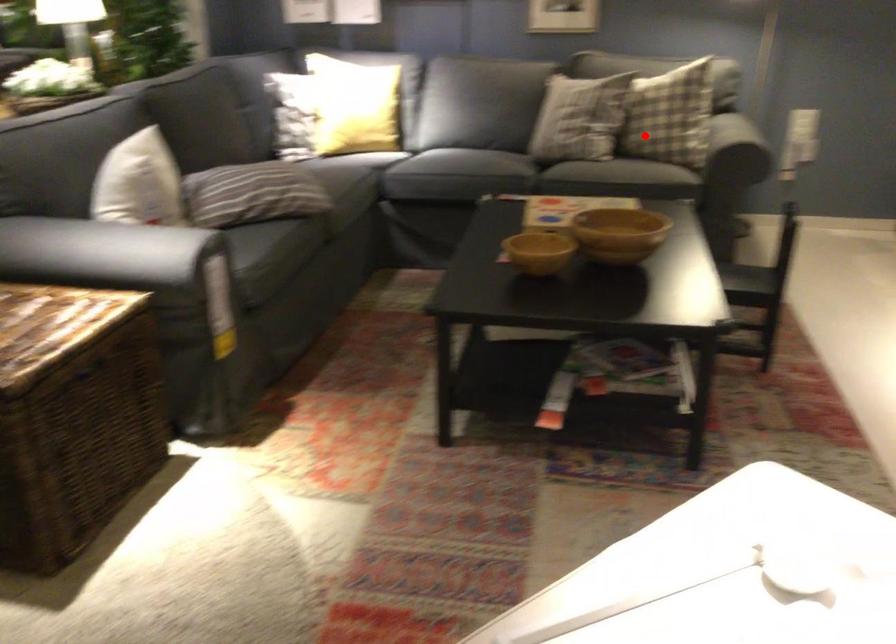
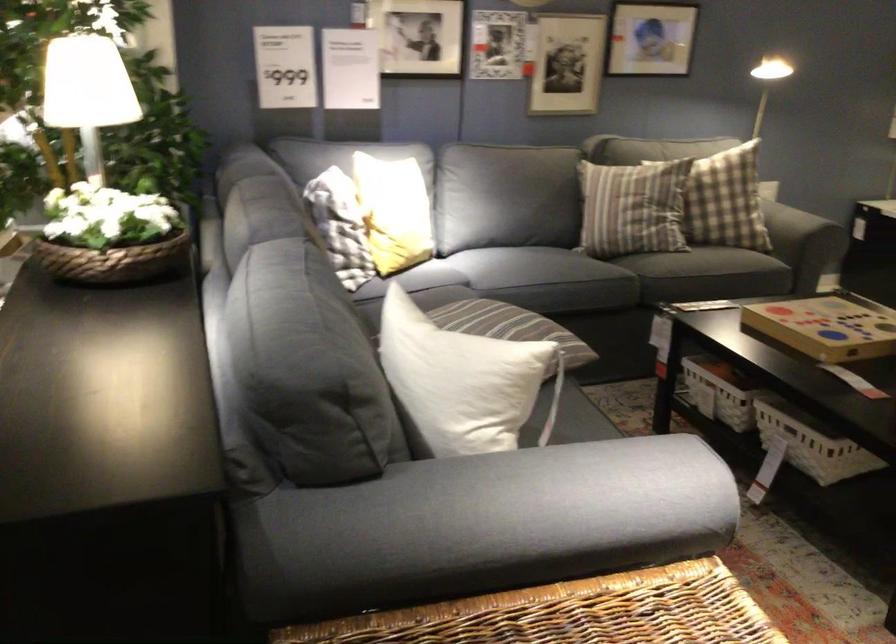
Question: I am providing you with two images of the same scene from different viewpoints. Given a red point in image1, look at the same physical point in image2. Is it:

Choices:
 (A) Closer to the viewpoint
 (B) Farther from the viewpoint

Answer: (A)